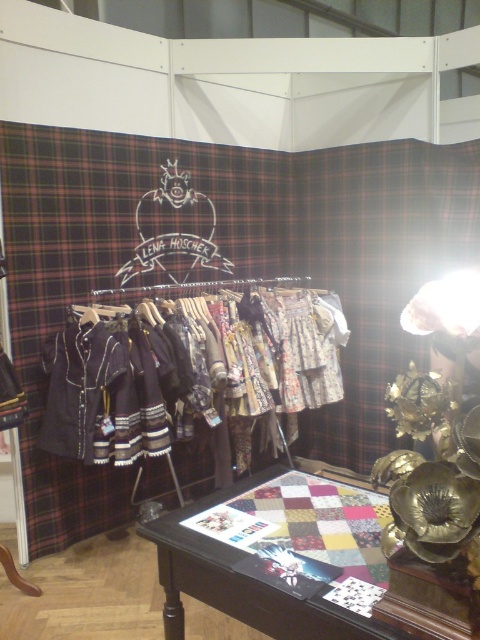
Question: Which point is farther to the camera?

Choices:
 (A) (466, 608)
 (B) (52, 362)

Answer: (B)

Question: Does textured woolen jackets at center have a lesser width compared to wooden quilted table at center?

Choices:
 (A) yes
 (B) no

Answer: (B)

Question: Is textured woolen jackets at center bigger than wooden quilted table at center?

Choices:
 (A) no
 (B) yes

Answer: (B)

Question: Which point appears closest to the camera in this image?

Choices:
 (A) (194, 512)
 (B) (315, 378)

Answer: (A)

Question: Can you confirm if textured woolen jackets at center is positioned to the right of wooden quilted table at center?

Choices:
 (A) no
 (B) yes

Answer: (A)